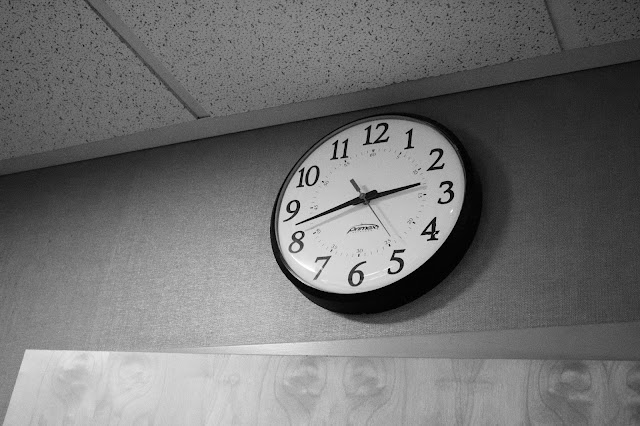
Where is `clock face`? The height and width of the screenshot is (426, 640). clock face is located at coordinates (381, 235).